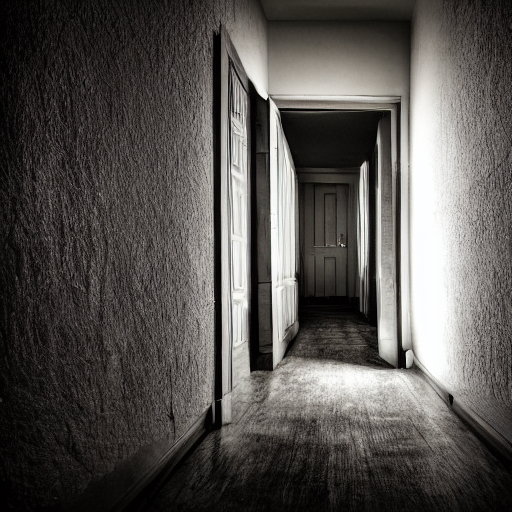
Find the location of a particular element. corridor is located at coordinates (317, 473).